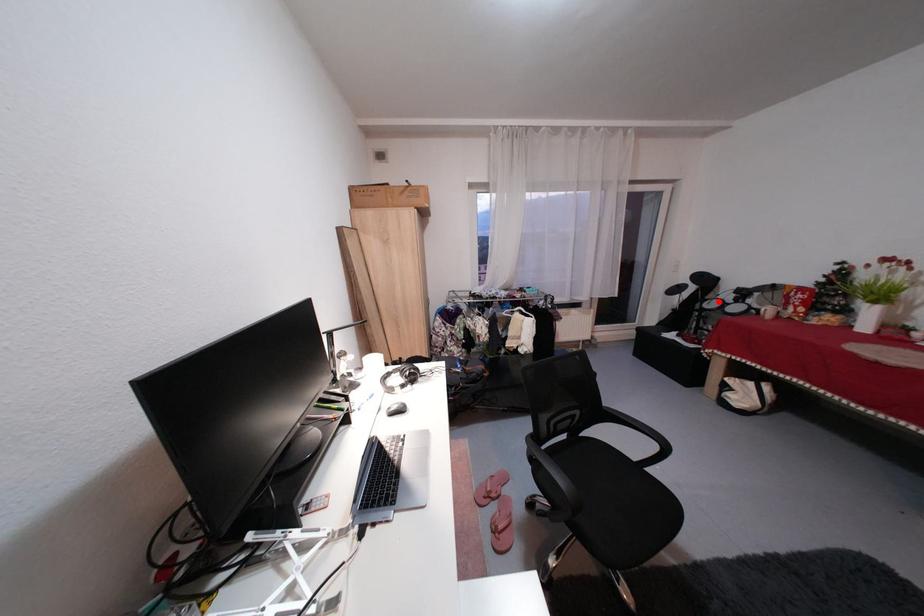
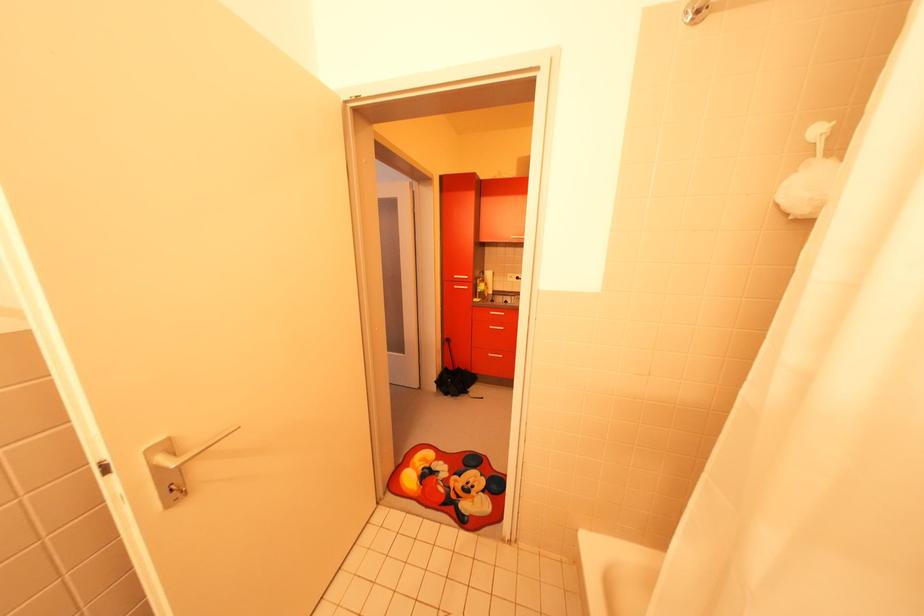
Question: I am providing you with two images of the same scene from different viewpoints. A red point is marked on the first image. Is the red point's position out of view in image 2?

Choices:
 (A) Yes
 (B) No

Answer: (A)